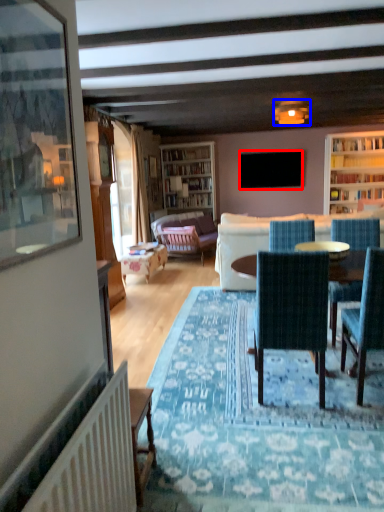
Question: Which object is closer to the camera taking this photo, television (highlighted by a red box) or lamp (highlighted by a blue box)?

Choices:
 (A) television
 (B) lamp

Answer: (B)